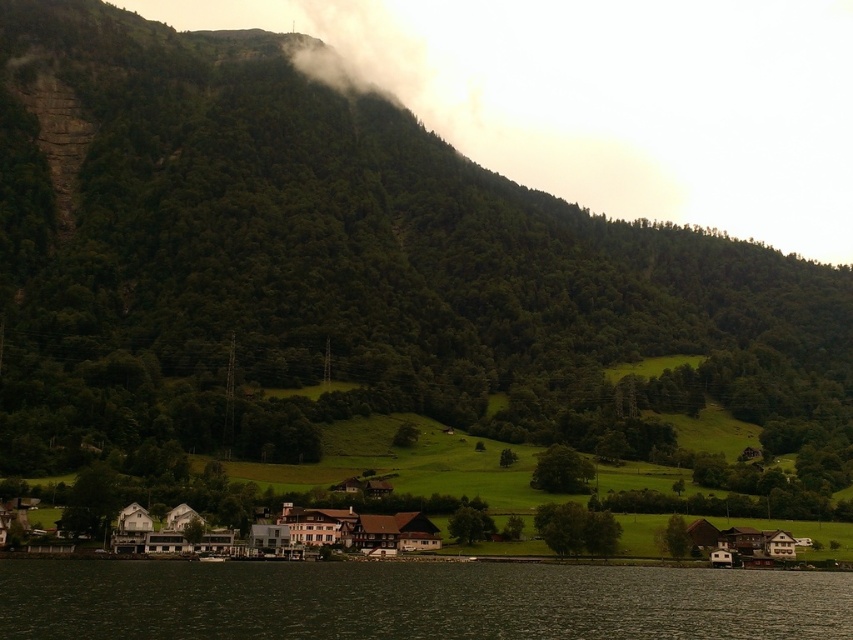
You are an environmental scientist analyzing this landscape. You need to determine which area is wider between the dark green water at lower center and the white fog at upper center. Based on the scene, which one has a greater width?

The white fog at upper center has a greater width than the dark green water at lower center.

You are standing at the top of the hill in the image and want to find the dark green water at lower center. Based on your position, in which direction should you look to see it?

The dark green water at lower center is located at point (415,602), which means you should look towards the lower center direction to see it.

You are a hiker standing at the base of the hill. You see the dark green water at lower center and the white fog at upper center. How far apart are these two landmarks from your perspective?

The dark green water at lower center and the white fog at upper center are 448.16 meters apart from each other.